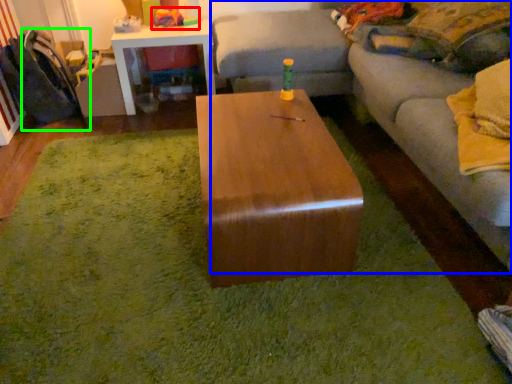
Question: Which object is positioned closest to toy (highlighted by a red box)? Select from studio couch (highlighted by a blue box) and swivel chair (highlighted by a green box).

Choices:
 (A) studio couch
 (B) swivel chair

Answer: (B)